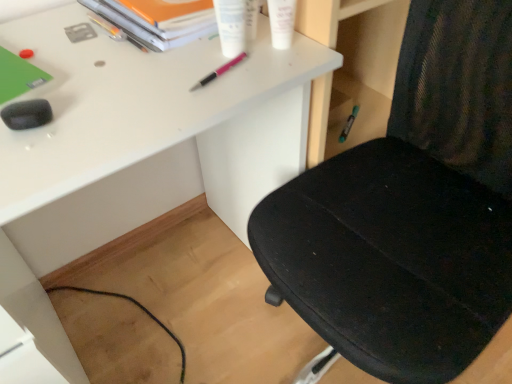
I want to click on vacant space that's between metallic silver pen at upper left, placed as the 2th stationery when sorted from back to front, and matte black earbuds at left, the 1th stationery in the front-to-back sequence, so click(x=68, y=61).